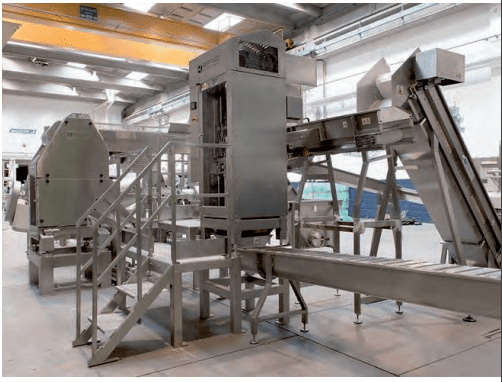
Find the location of a particular element. This screenshot has height=382, width=502. round silver feet is located at coordinates (257, 341), (305, 329), (360, 319), (400, 311), (341, 295), (296, 302).